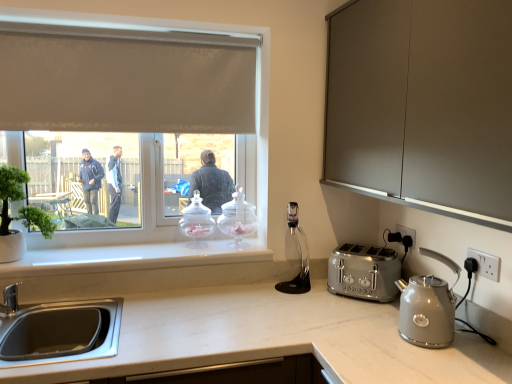
Question: Is there a large distance between clear glass jar at window, placed as the 2th kitchen appliance when sorted from left to right, and green matte plant at left?

Choices:
 (A) yes
 (B) no

Answer: (B)

Question: Does clear glass jar at window, placed as the 2th kitchen appliance when sorted from left to right, turn towards green matte plant at left?

Choices:
 (A) yes
 (B) no

Answer: (B)

Question: Is clear glass jar at window, which appears as the 3th kitchen appliance when viewed from the front, at the right side of green matte plant at left?

Choices:
 (A) yes
 (B) no

Answer: (A)

Question: From the image's perspective, is clear glass jar at window, which appears as the 3th kitchen appliance when viewed from the front, below green matte plant at left?

Choices:
 (A) no
 (B) yes

Answer: (B)

Question: Is clear glass jar at window, which appears as the 3th kitchen appliance when viewed from the front, positioned behind green matte plant at left?

Choices:
 (A) no
 (B) yes

Answer: (B)

Question: From the image's perspective, is matte silver kettle at right, acting as the first kitchen appliance starting from the right, above or below clear glass jar at window, placed as the 2th kitchen appliance when sorted from back to front?

Choices:
 (A) above
 (B) below

Answer: (B)

Question: Choose the correct answer: Is matte silver kettle at right, the 1th kitchen appliance viewed from the front, inside clear glass jar at window, the first kitchen appliance positioned from the left, or outside it?

Choices:
 (A) outside
 (B) inside

Answer: (A)

Question: Is matte silver kettle at right, acting as the first kitchen appliance starting from the right, in front of or behind clear glass jar at window, the 2th kitchen appliance from the front, in the image?

Choices:
 (A) behind
 (B) front

Answer: (B)

Question: Is point click(436, 278) positioned closer to the camera than point click(197, 244)?

Choices:
 (A) farther
 (B) closer

Answer: (B)

Question: Is clear glass jar at window, placed as the 2th kitchen appliance when sorted from left to right, wider or thinner than matte silver kettle at right, arranged as the 3th kitchen appliance when viewed from the left?

Choices:
 (A) wide
 (B) thin

Answer: (A)

Question: From their relative heights in the image, would you say clear glass jar at window, which appears as the 3th kitchen appliance when viewed from the front, is taller or shorter than matte silver kettle at right, arranged as the 3th kitchen appliance when viewed from the left?

Choices:
 (A) short
 (B) tall

Answer: (B)

Question: From a real-world perspective, relative to matte silver kettle at right, arranged as the 3th kitchen appliance when viewed from the left, is clear glass jar at window, placed as the 2th kitchen appliance when sorted from left to right, vertically above or below?

Choices:
 (A) above
 (B) below

Answer: (A)

Question: From the image's perspective, relative to matte silver kettle at right, the 1th kitchen appliance viewed from the front, is clear glass jar at window, the 2th kitchen appliance when ordered from right to left, above or below?

Choices:
 (A) below
 (B) above

Answer: (B)

Question: In terms of width, does green matte plant at left look wider or thinner when compared to black plastic electric outlet at lower right, which ranks as the 1th electric outlet in back-to-front order?

Choices:
 (A) wide
 (B) thin

Answer: (A)

Question: From the image's perspective, is green matte plant at left positioned above or below black plastic electric outlet at lower right, which is the 2th electric outlet from right to left?

Choices:
 (A) above
 (B) below

Answer: (A)